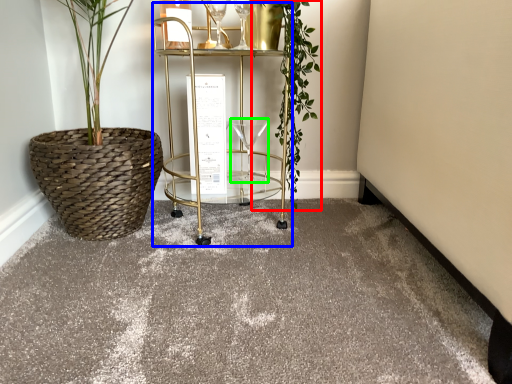
Question: Which object is the closest to the vegetation (highlighted by a red box)? Choose among these: cart (highlighted by a blue box) or wine glass (highlighted by a green box).

Choices:
 (A) cart
 (B) wine glass

Answer: (A)